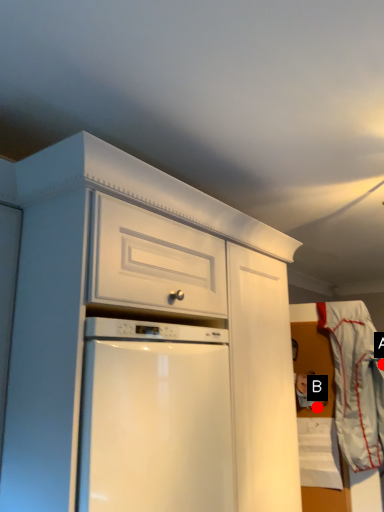
Question: Two points are circled on the image, labeled by A and B beside each circle. Which point is closer to the camera?

Choices:
 (A) A is closer
 (B) B is closer

Answer: (A)